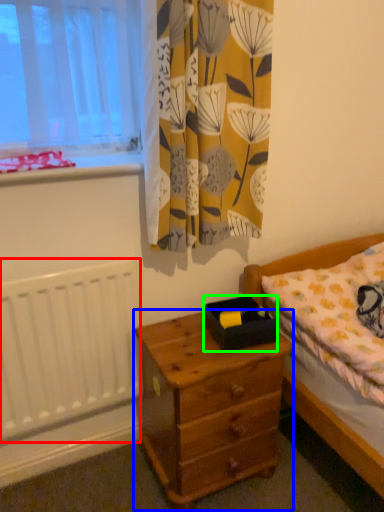
Question: Considering the real-world distances, which object is closest to radiator (highlighted by a red box)? nightstand (highlighted by a blue box) or box (highlighted by a green box).

Choices:
 (A) nightstand
 (B) box

Answer: (A)